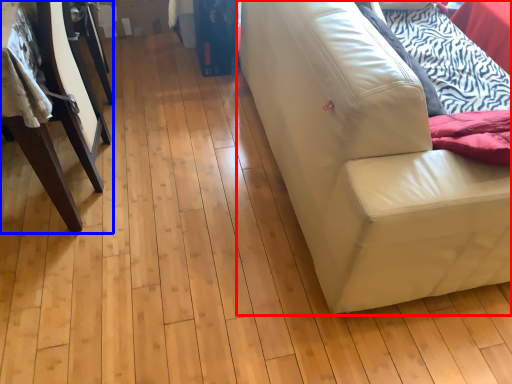
Question: Which object appears closest to the camera in this image, studio couch (highlighted by a red box) or furniture (highlighted by a blue box)?

Choices:
 (A) studio couch
 (B) furniture

Answer: (A)